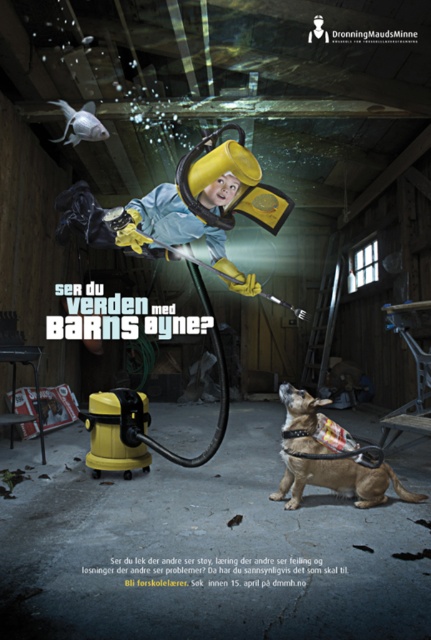
You are an observer in the scene. You notice the brown leather dog at lower right and the metallic silver sign at lower left. Which object is taller?

The brown leather dog at lower right is taller than the metallic silver sign at lower left.